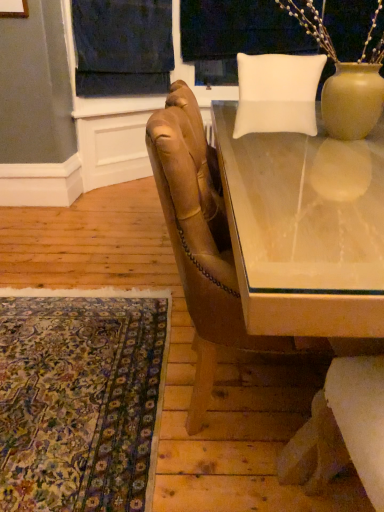
Question: Based on their sizes in the image, would you say white fabric at upper center is bigger or smaller than clear glass table at center?

Choices:
 (A) small
 (B) big

Answer: (A)

Question: Is white fabric at upper center to the left or to the right of clear glass table at center in the image?

Choices:
 (A) right
 (B) left

Answer: (B)

Question: Estimate the real-world distances between objects in this image. Which object is farther from the carpet with intricate patterns at lower left?

Choices:
 (A) clear glass table at center
 (B) dark blue fabric at upper center
 (C) white fabric at upper center
 (D) leather armchair at center

Answer: (C)

Question: Which of these objects is positioned closest to the white fabric at upper center?

Choices:
 (A) leather armchair at center
 (B) carpet with intricate patterns at lower left
 (C) dark blue fabric at upper center
 (D) clear glass table at center

Answer: (C)